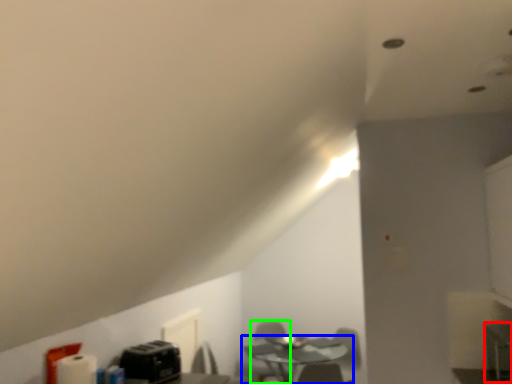
Question: Which is nearer to the computer desk (highlighted by a red box)? table (highlighted by a blue box) or swivel chair (highlighted by a green box).

Choices:
 (A) table
 (B) swivel chair

Answer: (A)